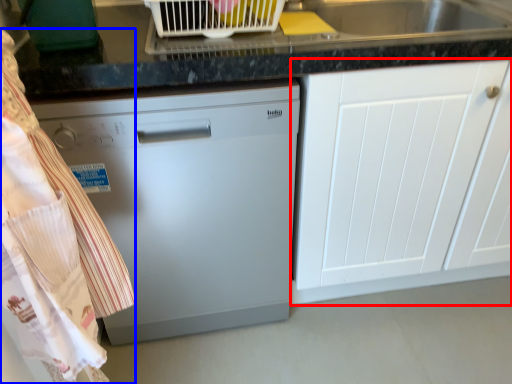
Question: Which of the following is the closest to the observer, cabinetry (highlighted by a red box) or laundry (highlighted by a blue box)?

Choices:
 (A) cabinetry
 (B) laundry

Answer: (B)